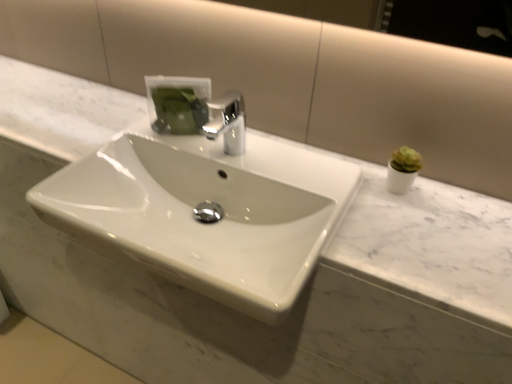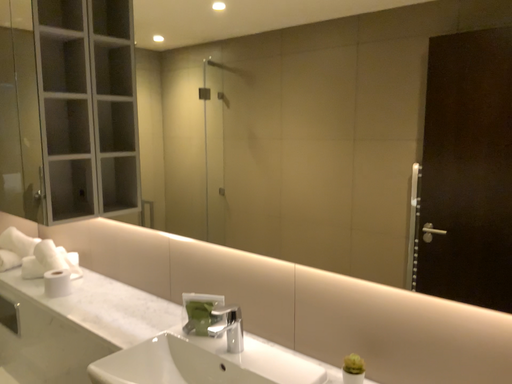
Question: Which way did the camera rotate in the video?

Choices:
 (A) rotated downward
 (B) rotated upward

Answer: (B)